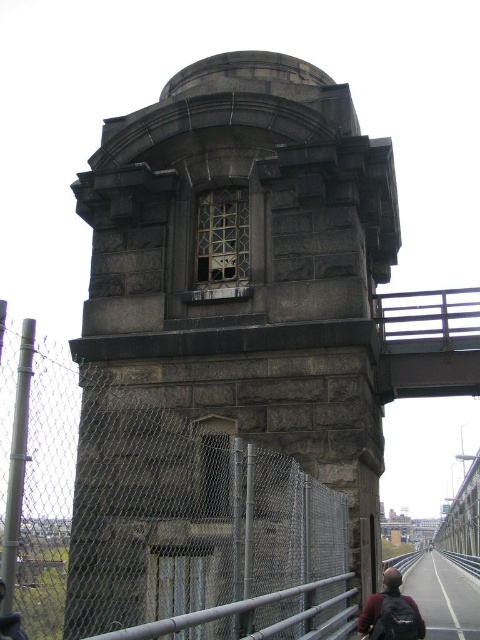
Is the position of metal chain-link fence at center less distant than that of metallic gray bridge at upper center?

Yes, metal chain-link fence at center is closer to the viewer.

Who is more distant from viewer, (218, 484) or (474, 376)?

Positioned behind is point (474, 376).

The image size is (480, 640). In order to click on metal chain-link fence at center in this screenshot , I will do `click(153, 516)`.

Between metallic gray bridge at upper center and dark brown backpack at lower right, which one is positioned higher?

metallic gray bridge at upper center

Does metallic gray bridge at upper center appear on the right side of dark brown backpack at lower right?

Indeed, metallic gray bridge at upper center is positioned on the right side of dark brown backpack at lower right.

Is point (429, 326) positioned after point (391, 637)?

Yes.

At what (x,y) coordinates should I click in order to perform the action: click on metallic gray bridge at upper center. Please return your answer as a coordinate pair (x, y). Looking at the image, I should click on (428, 342).

Does gray stone tower at center appear under dark brown backpack at lower right?

No.

Can you confirm if gray stone tower at center is taller than dark brown backpack at lower right?

Yes, gray stone tower at center is taller than dark brown backpack at lower right.

Between point (379, 554) and point (397, 602), which one is positioned behind?

Point (379, 554)

The width and height of the screenshot is (480, 640). Find the location of `gray stone tower at center`. gray stone tower at center is located at coordinates (230, 356).